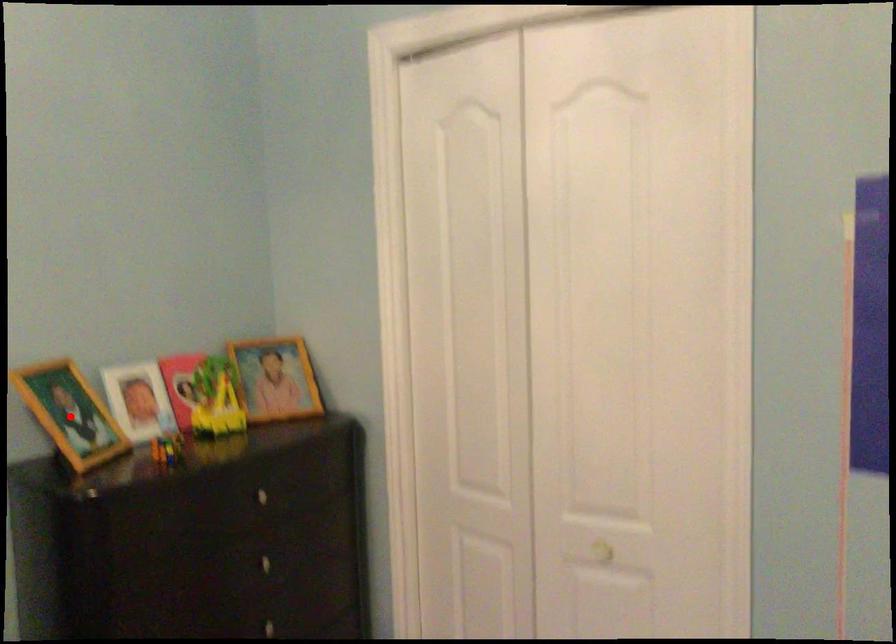
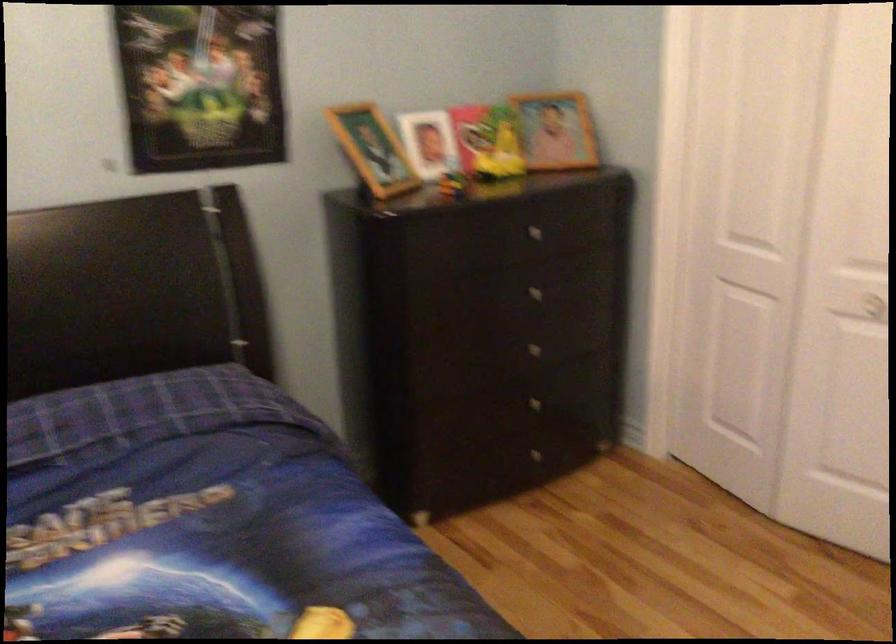
Find the pixel in the second image that matches the highlighted location in the first image.

(373, 149)